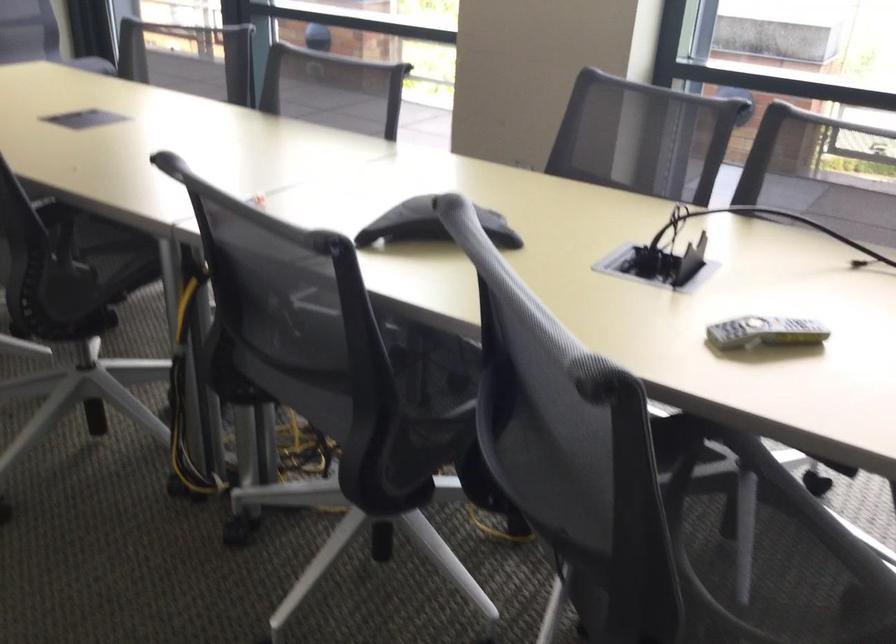
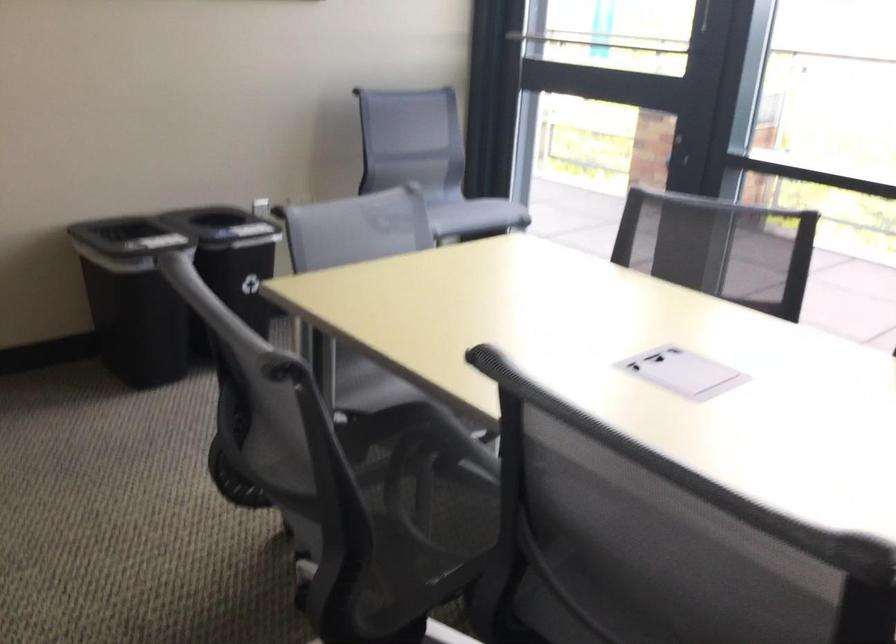
Which direction would the cameraman need to move to produce the second image?

The movement direction of the cameraman is left, forward.